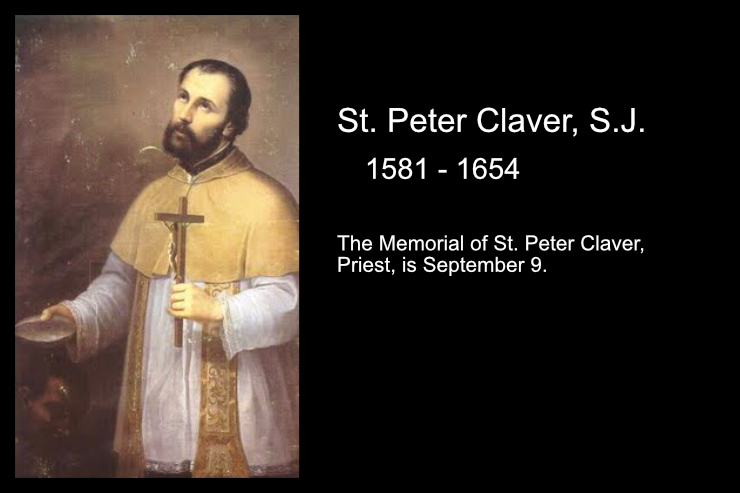
Find the location of a particular element. small bowl is located at coordinates (33, 330).